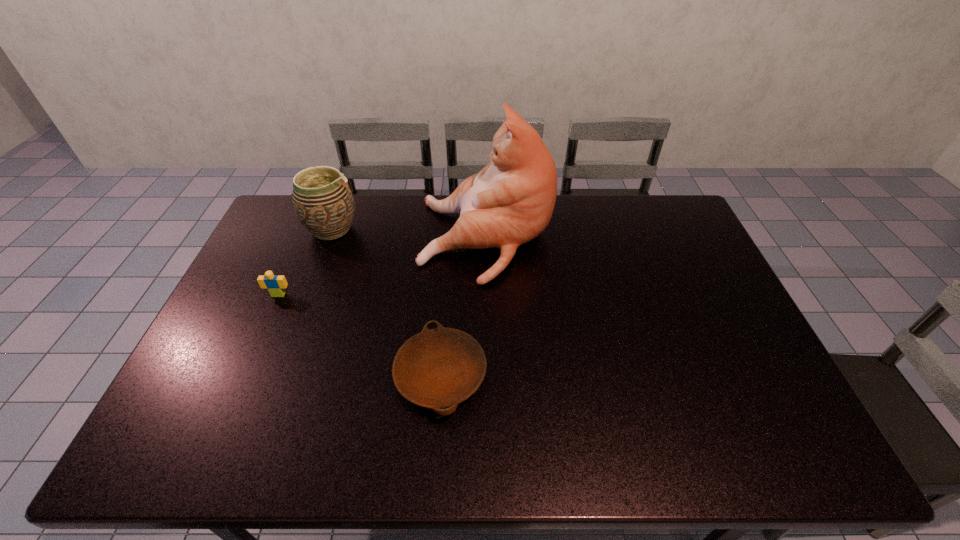
Where is `free space between the pottery and the cat`? free space between the pottery and the cat is located at coordinates (409, 235).

Point out which object is positioned as the third nearest to the Lego. Please provide its 2D coordinates. Your answer should be formatted as a tuple, i.e. [(x, y)], where the tuple contains the x and y coordinates of a point satisfying the conditions above.

[(438, 368)]

Point out which object is positioned as the third nearest to the third tallest object. Please provide its 2D coordinates. Your answer should be formatted as a tuple, i.e. [(x, y)], where the tuple contains the x and y coordinates of a point satisfying the conditions above.

[(438, 368)]

You are a GUI agent. You are given a task and a screenshot of the screen. Output one action in this format:
    pyautogui.click(x=<x>, y=<y>)
    Task: Click on the free spot that satisfies the following two spatial constraints: 1. on the face of the plate; 2. on the left side of the Lego
    The width and height of the screenshot is (960, 540).
    Given the screenshot: What is the action you would take?
    pyautogui.click(x=243, y=375)

Image resolution: width=960 pixels, height=540 pixels. Find the location of `free point that satisfies the following two spatial constraints: 1. on the face of the tallest object; 2. on the face of the Lego`. free point that satisfies the following two spatial constraints: 1. on the face of the tallest object; 2. on the face of the Lego is located at coordinates (487, 295).

Where is `blank area in the image that satisfies the following two spatial constraints: 1. on the face of the cat; 2. on the face of the second nearest object`? The height and width of the screenshot is (540, 960). blank area in the image that satisfies the following two spatial constraints: 1. on the face of the cat; 2. on the face of the second nearest object is located at coordinates (487, 295).

The width and height of the screenshot is (960, 540). Identify the location of vacant space that satisfies the following two spatial constraints: 1. on the face of the third tallest object; 2. on the right side of the shortest object. (243, 375).